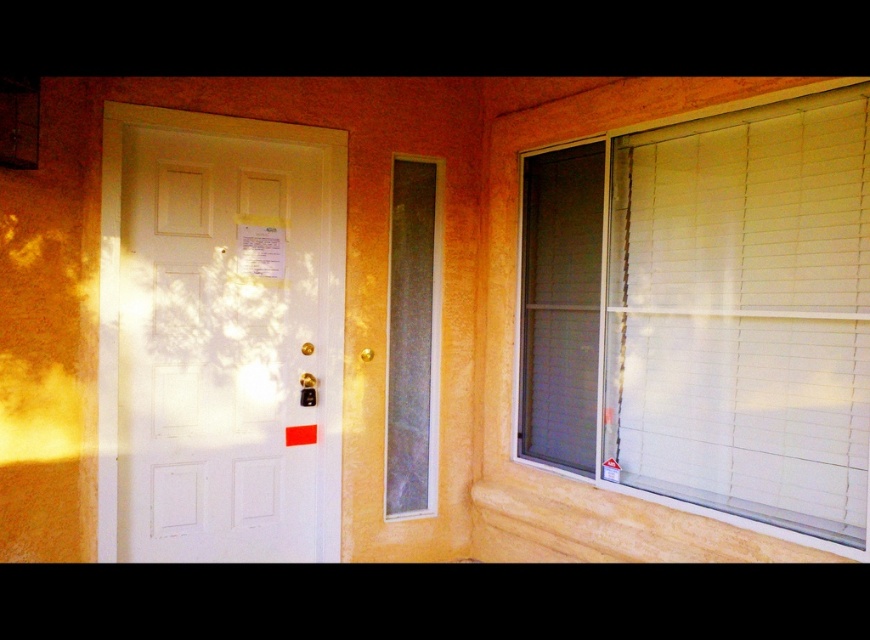
The image size is (870, 640). What do you see at coordinates (219, 337) in the screenshot? I see `white glossy screen door at left` at bounding box center [219, 337].

Between white glossy screen door at left and white matte blinds at right, which one is positioned higher?

Positioned higher is white matte blinds at right.

Measure the distance between point [175,246] and camera.

Point [175,246] and camera are 10.25 feet apart.

I want to click on white glossy screen door at left, so click(219, 337).

Measure the distance between white glossy screen door at left and clear glass window at center.

The distance of white glossy screen door at left from clear glass window at center is 26.54 inches.

Between white glossy screen door at left and clear glass window at center, which one appears on the left side from the viewer's perspective?

Positioned to the left is white glossy screen door at left.

At what (x,y) coordinates should I click in order to perform the action: click on white glossy screen door at left. Please return your answer as a coordinate pair (x, y). This screenshot has width=870, height=640. Looking at the image, I should click on (219, 337).

Measure the distance between point (798, 125) and camera.

Point (798, 125) is 8.46 feet from camera.

Does white matte blinds at right have a greater width compared to clear glass window at center?

Correct, the width of white matte blinds at right exceeds that of clear glass window at center.

Locate an element on the screen. Image resolution: width=870 pixels, height=640 pixels. white matte blinds at right is located at coordinates (744, 312).